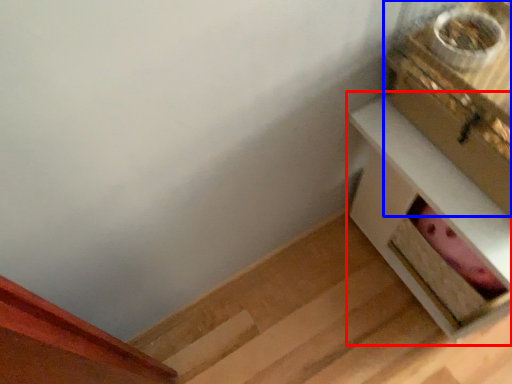
Question: Which object is further to the camera taking this photo, table (highlighted by a red box) or box (highlighted by a blue box)?

Choices:
 (A) table
 (B) box

Answer: (A)